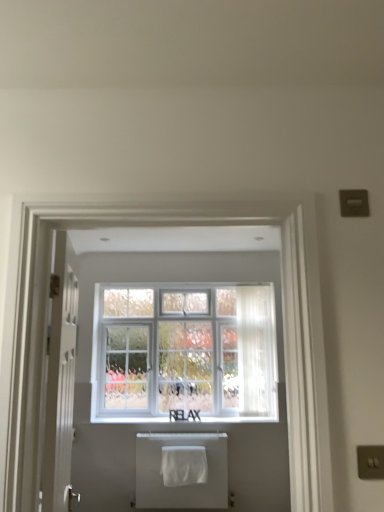
Question: From the image's perspective, is white matte window sill at center over white textured window at center?

Choices:
 (A) no
 (B) yes

Answer: (A)

Question: Can you confirm if white matte window sill at center is positioned to the right of white textured window at center?

Choices:
 (A) no
 (B) yes

Answer: (B)

Question: Does white matte window sill at center have a smaller size compared to white textured window at center?

Choices:
 (A) yes
 (B) no

Answer: (A)

Question: From a real-world perspective, is white matte window sill at center over white textured window at center?

Choices:
 (A) yes
 (B) no

Answer: (B)

Question: Is white matte window sill at center far away from white textured window at center?

Choices:
 (A) yes
 (B) no

Answer: (B)

Question: Is white matte window sill at center bigger than white textured window at center?

Choices:
 (A) yes
 (B) no

Answer: (B)

Question: From the image's perspective, does white glossy door at left appear higher than white matte window sill at center?

Choices:
 (A) no
 (B) yes

Answer: (B)

Question: From the image's perspective, is white glossy door at left beneath white matte window sill at center?

Choices:
 (A) no
 (B) yes

Answer: (A)

Question: Considering the relative positions of white glossy door at left and white matte window sill at center in the image provided, is white glossy door at left behind white matte window sill at center?

Choices:
 (A) yes
 (B) no

Answer: (B)

Question: Is white glossy door at left touching white matte window sill at center?

Choices:
 (A) yes
 (B) no

Answer: (B)

Question: From a real-world perspective, is white glossy door at left on white matte window sill at center?

Choices:
 (A) no
 (B) yes

Answer: (B)

Question: Is white glossy door at left wider than white matte window sill at center?

Choices:
 (A) no
 (B) yes

Answer: (A)

Question: Can you confirm if white fabric bath towel at lower center, which ranks as the first bath towel in front-to-back order, is smaller than white matte window sill at center?

Choices:
 (A) no
 (B) yes

Answer: (A)